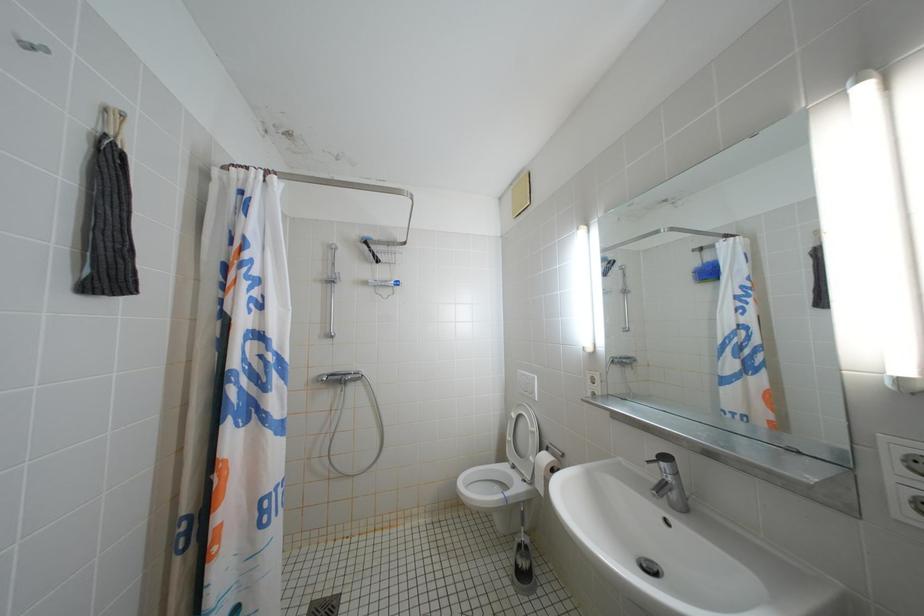
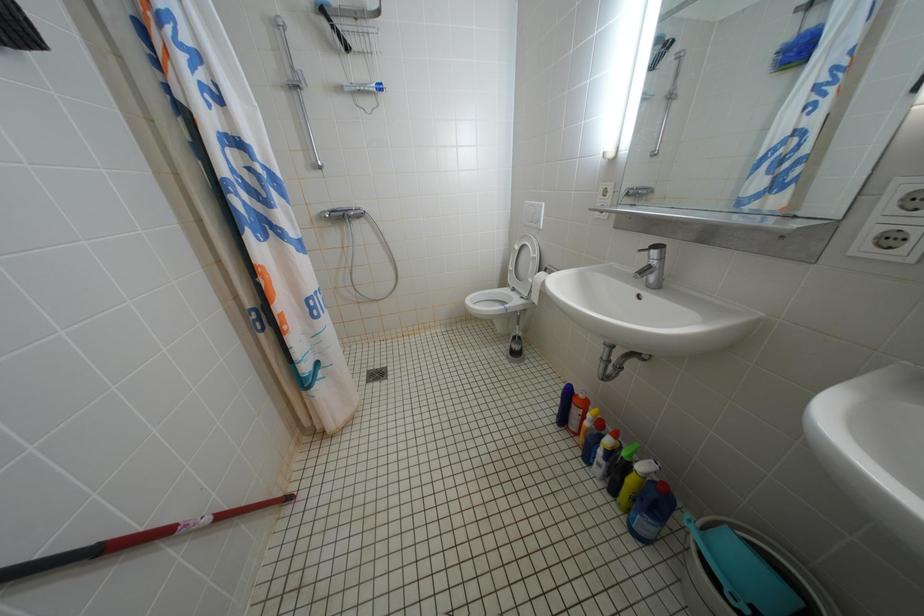
Question: The images are taken continuously from a first-person perspective. In which direction is your viewpoint rotating?

Choices:
 (A) Left
 (B) Right
 (C) Up
 (D) Down

Answer: (D)